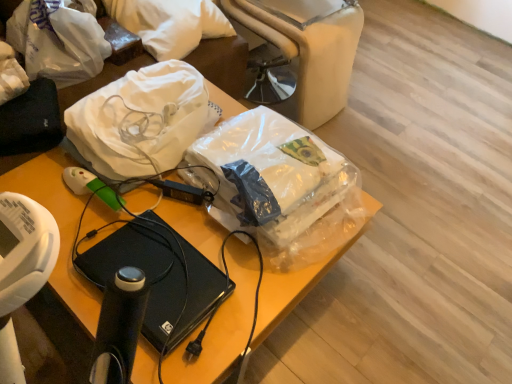
Question: Can you confirm if translucent plastic bag at center, which appears as the 1th plastic bag when viewed from the right, is thinner than transparent plastic bag at upper center, the 2th plastic bag in the left-to-right sequence?

Choices:
 (A) no
 (B) yes

Answer: (A)

Question: Would you say transparent plastic bag at upper center, placed as the second plastic bag when sorted from right to left, is part of translucent plastic bag at center, which appears as the 1th plastic bag when viewed from the right,'s contents?

Choices:
 (A) yes
 (B) no

Answer: (B)

Question: Does translucent plastic bag at center, positioned as the 3th plastic bag in left-to-right order, lie behind transparent plastic bag at upper center, placed as the second plastic bag when sorted from right to left?

Choices:
 (A) yes
 (B) no

Answer: (B)

Question: Is translucent plastic bag at center, which appears as the 1th plastic bag when viewed from the right, directly adjacent to transparent plastic bag at upper center, the 2th plastic bag in the left-to-right sequence?

Choices:
 (A) yes
 (B) no

Answer: (B)

Question: Does translucent plastic bag at center, positioned as the 3th plastic bag in left-to-right order, have a greater width compared to transparent plastic bag at upper center, placed as the second plastic bag when sorted from right to left?

Choices:
 (A) yes
 (B) no

Answer: (A)

Question: Looking at their shapes, would you say white soft pillow at upper left is wider or thinner than beige fabric bean bag chair at upper center?

Choices:
 (A) wide
 (B) thin

Answer: (B)

Question: From a real-world perspective, is white soft pillow at upper left positioned above or below beige fabric bean bag chair at upper center?

Choices:
 (A) below
 (B) above

Answer: (B)

Question: In terms of height, does white soft pillow at upper left look taller or shorter compared to beige fabric bean bag chair at upper center?

Choices:
 (A) short
 (B) tall

Answer: (A)

Question: In terms of size, does white soft pillow at upper left appear bigger or smaller than beige fabric bean bag chair at upper center?

Choices:
 (A) small
 (B) big

Answer: (A)

Question: Is point (163, 3) closer or farther from the camera than point (103, 44)?

Choices:
 (A) closer
 (B) farther

Answer: (B)

Question: From a real-world perspective, is white soft pillow at upper left physically located above or below white matte plastic bag at upper left, which is the 1th plastic bag in left-to-right order?

Choices:
 (A) above
 (B) below

Answer: (B)

Question: Considering the positions of white soft pillow at upper left and white matte plastic bag at upper left, which is the 1th plastic bag in left-to-right order, in the image, is white soft pillow at upper left taller or shorter than white matte plastic bag at upper left, which is the 1th plastic bag in left-to-right order,?

Choices:
 (A) tall
 (B) short

Answer: (B)

Question: Is white soft pillow at upper left inside or outside of white matte plastic bag at upper left, which is the 1th plastic bag in left-to-right order?

Choices:
 (A) inside
 (B) outside

Answer: (B)

Question: Relative to white matte plastic bag at upper left, which is the 1th plastic bag in left-to-right order, is translucent plastic bag at center, positioned as the 3th plastic bag in left-to-right order, in front or behind?

Choices:
 (A) front
 (B) behind

Answer: (A)

Question: Looking at their shapes, would you say translucent plastic bag at center, positioned as the 3th plastic bag in left-to-right order, is wider or thinner than white matte plastic bag at upper left, which is the 1th plastic bag in left-to-right order?

Choices:
 (A) thin
 (B) wide

Answer: (B)